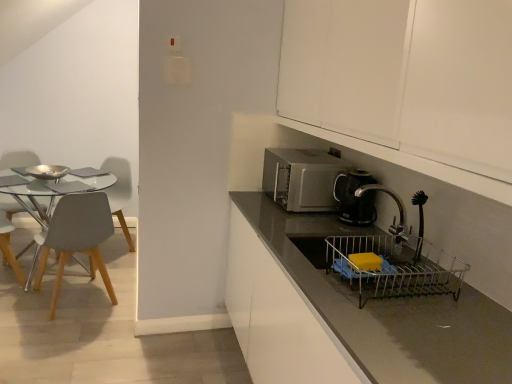
The width and height of the screenshot is (512, 384). What are the coordinates of `blank area beneath light gray plastic chair at left, the 4th chair from the left (from a real-world perspective)` in the screenshot? It's located at (78, 305).